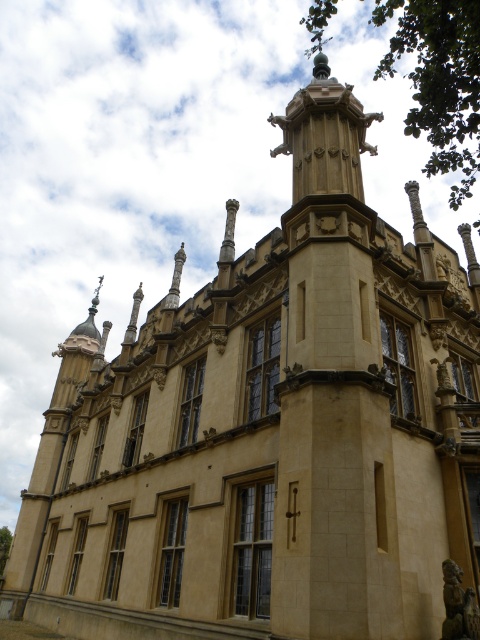
You are standing in front of the historic building and want to take a photo that includes both point A at point (446,131) and point B at point (0,540). Which point will appear larger in your photo?

Point A at point (446,131) will appear larger in the photo because it is closer to the camera than point B at point (0,540).